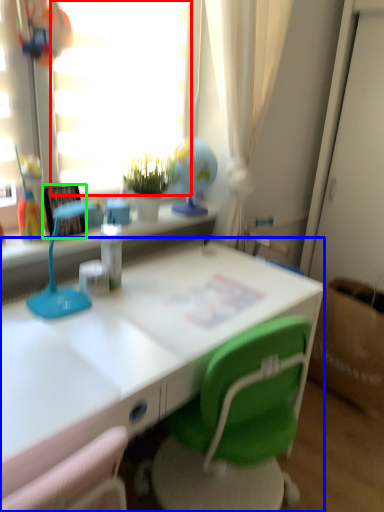
Question: Considering the real-world distances, which object is farthest from window screen (highlighted by a red box)? desk (highlighted by a blue box) or picture frame (highlighted by a green box)?

Choices:
 (A) desk
 (B) picture frame

Answer: (A)